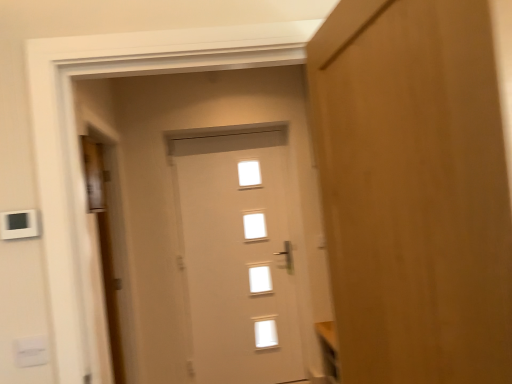
Question: Considering the relative sizes of wooden door at right, which ranks as the first door in right-to-left order, and white plastic light switch at lower left, the first light switch when ordered from bottom to top, in the image provided, is wooden door at right, which ranks as the first door in right-to-left order, shorter than white plastic light switch at lower left, the first light switch when ordered from bottom to top,?

Choices:
 (A) yes
 (B) no

Answer: (B)

Question: Is wooden door at right, which is counted as the first door, starting from the front, outside white plastic light switch at lower left, which ranks as the second light switch in top-to-bottom order?

Choices:
 (A) yes
 (B) no

Answer: (A)

Question: From a real-world perspective, is wooden door at right, the 3th door in the back-to-front sequence, on top of white plastic light switch at lower left, which ranks as the second light switch in top-to-bottom order?

Choices:
 (A) no
 (B) yes

Answer: (B)

Question: Is wooden door at right, which ranks as the first door in right-to-left order, smaller than white plastic light switch at lower left, the first light switch when ordered from bottom to top?

Choices:
 (A) yes
 (B) no

Answer: (B)

Question: Can you see wooden door at right, the 3th door in the back-to-front sequence, touching white plastic light switch at lower left, which ranks as the second light switch in top-to-bottom order?

Choices:
 (A) yes
 (B) no

Answer: (B)

Question: Considering the relative sizes of wooden door at right, which ranks as the first door in right-to-left order, and white plastic light switch at lower left, which ranks as the second light switch in top-to-bottom order, in the image provided, is wooden door at right, which ranks as the first door in right-to-left order, bigger than white plastic light switch at lower left, which ranks as the second light switch in top-to-bottom order,?

Choices:
 (A) no
 (B) yes

Answer: (B)

Question: From a real-world perspective, is white plastic light switch at upper left, the 2th light switch ordered from the bottom, below wooden door at left, marked as the third door in a right-to-left arrangement?

Choices:
 (A) no
 (B) yes

Answer: (A)

Question: Can you confirm if white plastic light switch at upper left, the 2th light switch ordered from the bottom, is bigger than wooden door at left, marked as the third door in a right-to-left arrangement?

Choices:
 (A) no
 (B) yes

Answer: (A)

Question: Is the position of white plastic light switch at upper left, the 2th light switch ordered from the bottom, more distant than that of wooden door at left, the second door when ordered from front to back?

Choices:
 (A) yes
 (B) no

Answer: (B)

Question: Is white plastic light switch at upper left, the 2th light switch ordered from the bottom, to the left of wooden door at left, the second door when ordered from front to back, from the viewer's perspective?

Choices:
 (A) no
 (B) yes

Answer: (A)

Question: Is white plastic light switch at upper left, positioned as the first light switch in top-to-bottom order, positioned in front of wooden door at left, marked as the third door in a right-to-left arrangement?

Choices:
 (A) no
 (B) yes

Answer: (B)

Question: Does white plastic light switch at upper left, the 2th light switch ordered from the bottom, have a lesser height compared to wooden door at left, marked as the third door in a right-to-left arrangement?

Choices:
 (A) no
 (B) yes

Answer: (B)

Question: Does white plastic light switch at upper left, the 2th light switch ordered from the bottom, contain wooden door at right, which is counted as the first door, starting from the front?

Choices:
 (A) no
 (B) yes

Answer: (A)